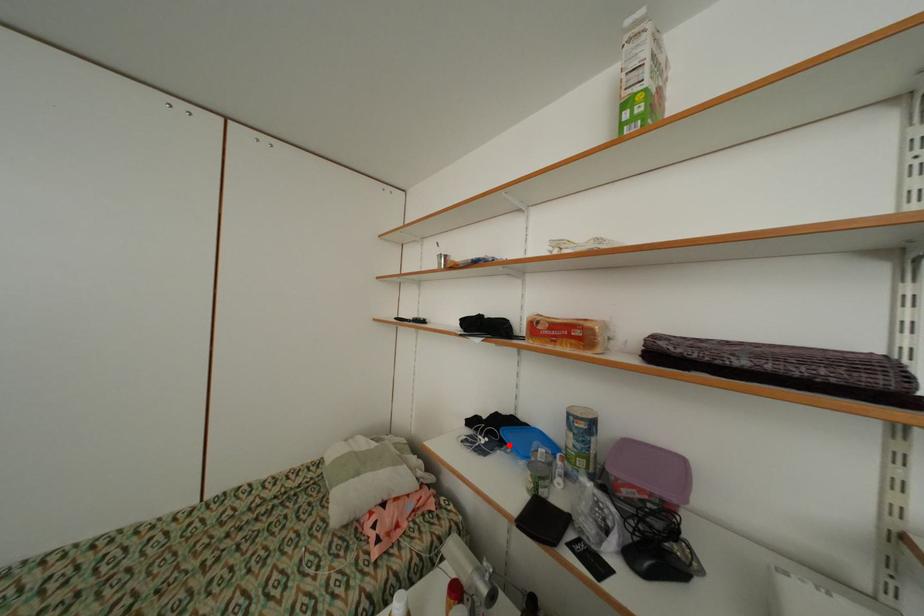
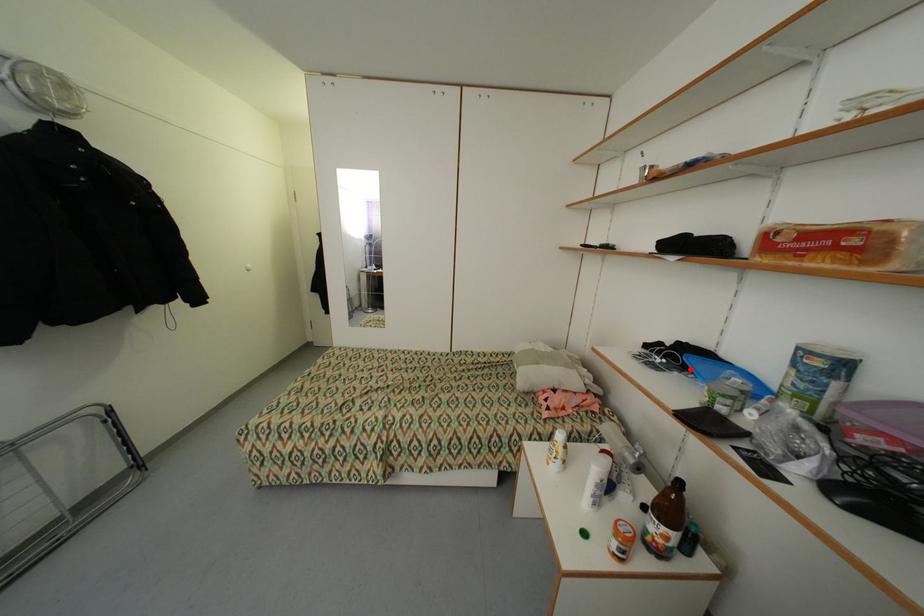
I am providing you with two images of the same scene from different viewpoints. A red point is marked on the first image and another point is marked on the second image. Do the highlighted points in image1 and image2 indicate the same real-world spot?

Yes